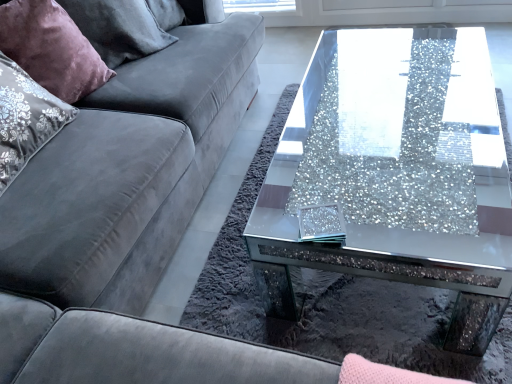
Question: Is sparkly glass coffee table at center wider than velvet purple pillow at upper left?

Choices:
 (A) yes
 (B) no

Answer: (A)

Question: Is sparkly glass coffee table at center beside velvet purple pillow at upper left?

Choices:
 (A) no
 (B) yes

Answer: (A)

Question: Is sparkly glass coffee table at center far away from velvet purple pillow at upper left?

Choices:
 (A) no
 (B) yes

Answer: (A)

Question: Is sparkly glass coffee table at center shorter than velvet purple pillow at upper left?

Choices:
 (A) yes
 (B) no

Answer: (A)

Question: Is sparkly glass coffee table at center thinner than velvet purple pillow at upper left?

Choices:
 (A) no
 (B) yes

Answer: (A)

Question: Is velvet purple pillow at upper left at the back of sparkly glass coffee table at center?

Choices:
 (A) yes
 (B) no

Answer: (B)

Question: Can you confirm if velvet grey couch at left is wider than sparkly glass coffee table at center?

Choices:
 (A) yes
 (B) no

Answer: (A)

Question: From the image's perspective, is velvet grey couch at left beneath sparkly glass coffee table at center?

Choices:
 (A) no
 (B) yes

Answer: (A)

Question: From a real-world perspective, is velvet grey couch at left physically above sparkly glass coffee table at center?

Choices:
 (A) yes
 (B) no

Answer: (A)

Question: Is velvet grey couch at left to the right of sparkly glass coffee table at center from the viewer's perspective?

Choices:
 (A) yes
 (B) no

Answer: (B)

Question: Does velvet grey couch at left appear on the left side of sparkly glass coffee table at center?

Choices:
 (A) yes
 (B) no

Answer: (A)

Question: Would you say velvet grey couch at left contains sparkly glass coffee table at center?

Choices:
 (A) no
 (B) yes

Answer: (A)

Question: Is sparkly glass coffee table at center wider than velvet grey couch at left?

Choices:
 (A) yes
 (B) no

Answer: (B)